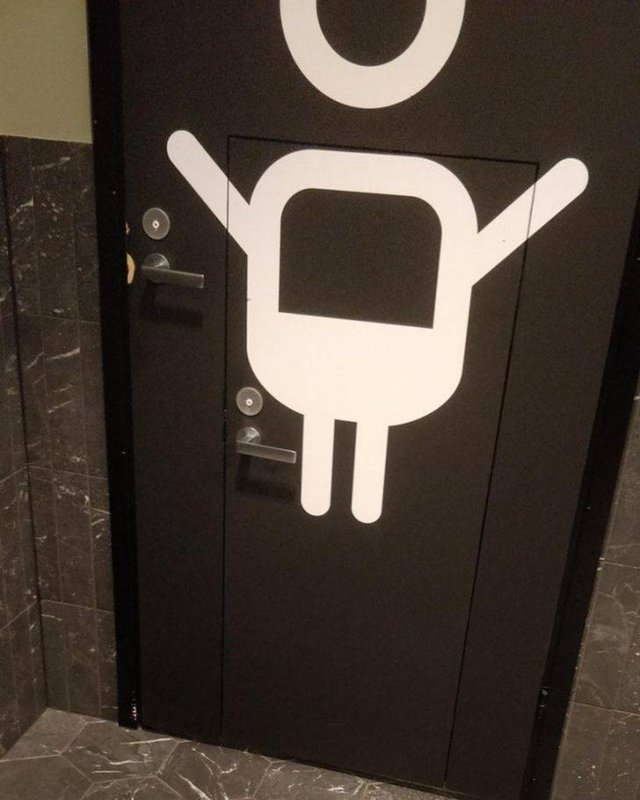
I want to click on floor, so click(x=182, y=762).